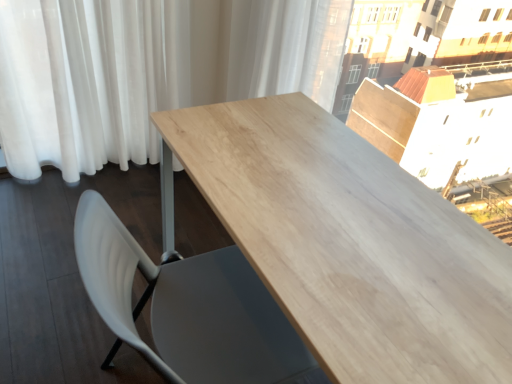
Question: Is white sheer curtain at upper center, positioned as the 2th curtain in left-to-right order, at the left side of light wood table at center?

Choices:
 (A) no
 (B) yes

Answer: (A)

Question: Is white sheer curtain at upper center, positioned as the 2th curtain in left-to-right order, shorter than light wood table at center?

Choices:
 (A) no
 (B) yes

Answer: (B)

Question: Considering the relative positions of white sheer curtain at upper center, arranged as the first curtain when viewed from the right, and light wood table at center in the image provided, is white sheer curtain at upper center, arranged as the first curtain when viewed from the right, to the right of light wood table at center from the viewer's perspective?

Choices:
 (A) no
 (B) yes

Answer: (B)

Question: Is white sheer curtain at upper center, arranged as the first curtain when viewed from the right, wider than light wood table at center?

Choices:
 (A) yes
 (B) no

Answer: (B)

Question: Is white sheer curtain at upper center, positioned as the 2th curtain in left-to-right order, aimed at light wood table at center?

Choices:
 (A) no
 (B) yes

Answer: (A)

Question: From the image's perspective, is white sheer curtain at upper center, arranged as the first curtain when viewed from the right, positioned above or below light wood table at center?

Choices:
 (A) above
 (B) below

Answer: (A)

Question: Considering the positions of white sheer curtain at upper center, arranged as the first curtain when viewed from the right, and light wood table at center in the image, is white sheer curtain at upper center, arranged as the first curtain when viewed from the right, wider or thinner than light wood table at center?

Choices:
 (A) wide
 (B) thin

Answer: (B)

Question: From a real-world perspective, relative to light wood table at center, is white sheer curtain at upper center, positioned as the 2th curtain in left-to-right order, vertically above or below?

Choices:
 (A) above
 (B) below

Answer: (A)

Question: Is white sheer curtain at upper center, arranged as the first curtain when viewed from the right, situated inside light wood table at center or outside?

Choices:
 (A) outside
 (B) inside

Answer: (A)

Question: Looking at their shapes, would you say white sheer curtain at upper center, arranged as the first curtain when viewed from the right, is wider or thinner than white plastic chair at lower left?

Choices:
 (A) wide
 (B) thin

Answer: (B)

Question: Based on their positions, is white sheer curtain at upper center, arranged as the first curtain when viewed from the right, located to the left or right of white plastic chair at lower left?

Choices:
 (A) left
 (B) right

Answer: (B)

Question: Is white sheer curtain at upper center, arranged as the first curtain when viewed from the right, situated inside white plastic chair at lower left or outside?

Choices:
 (A) inside
 (B) outside

Answer: (B)

Question: From the image's perspective, is white sheer curtain at upper center, positioned as the 2th curtain in left-to-right order, located above or below white plastic chair at lower left?

Choices:
 (A) below
 (B) above

Answer: (B)

Question: In terms of width, does white plastic chair at lower left look wider or thinner when compared to white sheer curtain at left, arranged as the 1th curtain when viewed from the left?

Choices:
 (A) wide
 (B) thin

Answer: (A)

Question: Is white plastic chair at lower left in front of or behind white sheer curtain at left, arranged as the 1th curtain when viewed from the left, in the image?

Choices:
 (A) front
 (B) behind

Answer: (A)